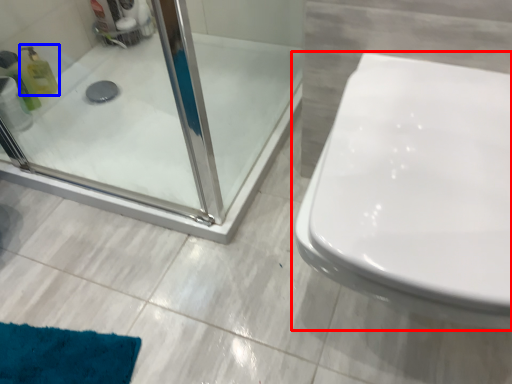
Question: Which of the following is the closest to the observer, toilet (highlighted by a red box) or cleaning product (highlighted by a blue box)?

Choices:
 (A) toilet
 (B) cleaning product

Answer: (A)